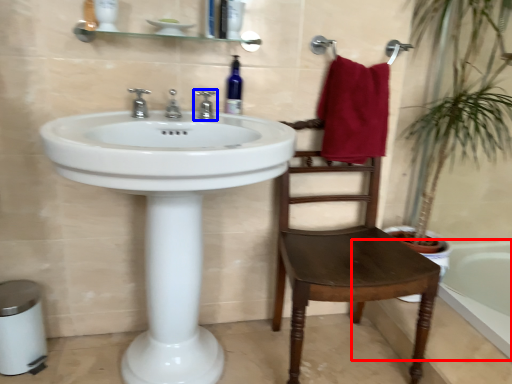
Question: Which point is further to the camera, bath (highlighted by a red box) or tap (highlighted by a blue box)?

Choices:
 (A) bath
 (B) tap

Answer: (B)